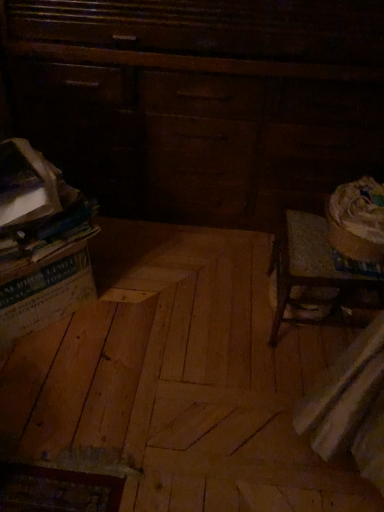
Question: Is dark wood dresser at upper left next to natural wood plywood at center and touching it?

Choices:
 (A) no
 (B) yes

Answer: (A)

Question: Is dark wood dresser at upper left not close to natural wood plywood at center?

Choices:
 (A) yes
 (B) no

Answer: (B)

Question: Is dark wood dresser at upper left closer to camera compared to natural wood plywood at center?

Choices:
 (A) yes
 (B) no

Answer: (B)

Question: Does dark wood dresser at upper left have a lesser height compared to natural wood plywood at center?

Choices:
 (A) no
 (B) yes

Answer: (A)

Question: From the image's perspective, does dark wood dresser at upper left appear lower than natural wood plywood at center?

Choices:
 (A) no
 (B) yes

Answer: (A)

Question: From a real-world perspective, is dark wood dresser at upper left located higher than natural wood plywood at center?

Choices:
 (A) yes
 (B) no

Answer: (A)

Question: Can you confirm if natural wood plywood at center is bigger than dark wood dresser at upper left?

Choices:
 (A) no
 (B) yes

Answer: (A)

Question: Is the depth of natural wood plywood at center less than that of dark wood dresser at upper left?

Choices:
 (A) no
 (B) yes

Answer: (B)

Question: Is natural wood plywood at center to the right of dark wood dresser at upper left from the viewer's perspective?

Choices:
 (A) yes
 (B) no

Answer: (B)

Question: Does natural wood plywood at center lie behind dark wood dresser at upper left?

Choices:
 (A) yes
 (B) no

Answer: (B)

Question: Is natural wood plywood at center next to dark wood dresser at upper left?

Choices:
 (A) yes
 (B) no

Answer: (B)

Question: Is natural wood plywood at center surrounding dark wood dresser at upper left?

Choices:
 (A) yes
 (B) no

Answer: (B)

Question: Is dark wood dresser at upper left inside or outside of natural wood plywood at center?

Choices:
 (A) outside
 (B) inside

Answer: (A)